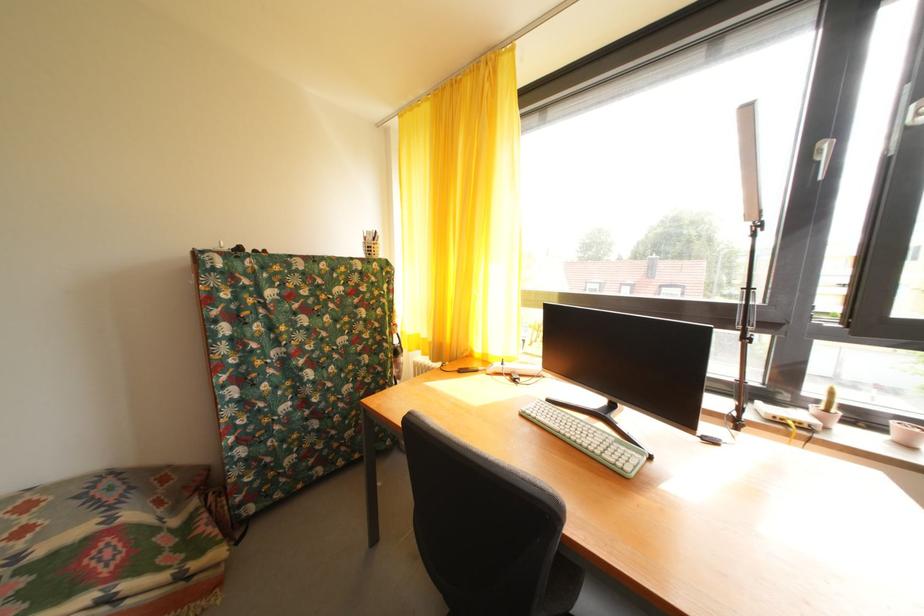
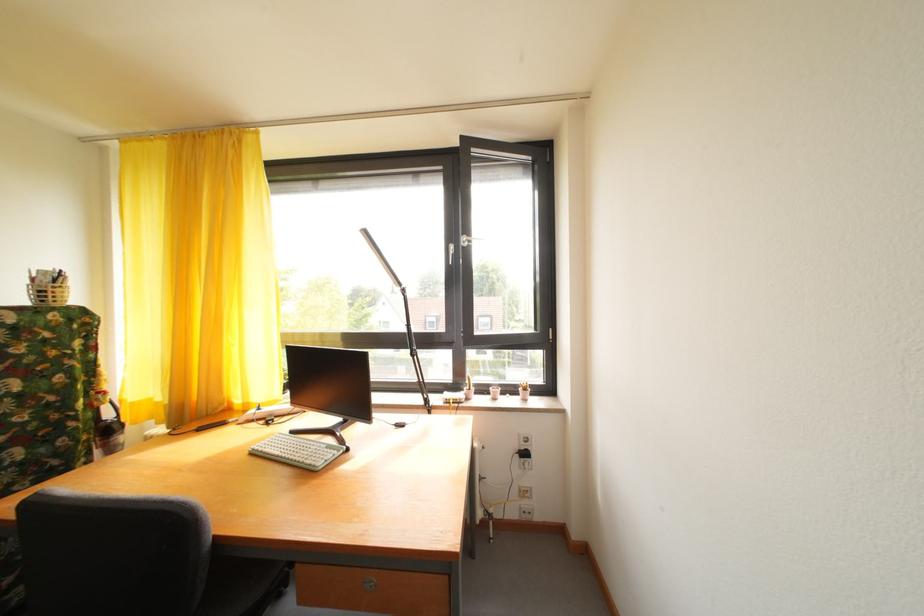
In the second image, find the point that corresponds to point (745, 334) in the first image.

(416, 355)